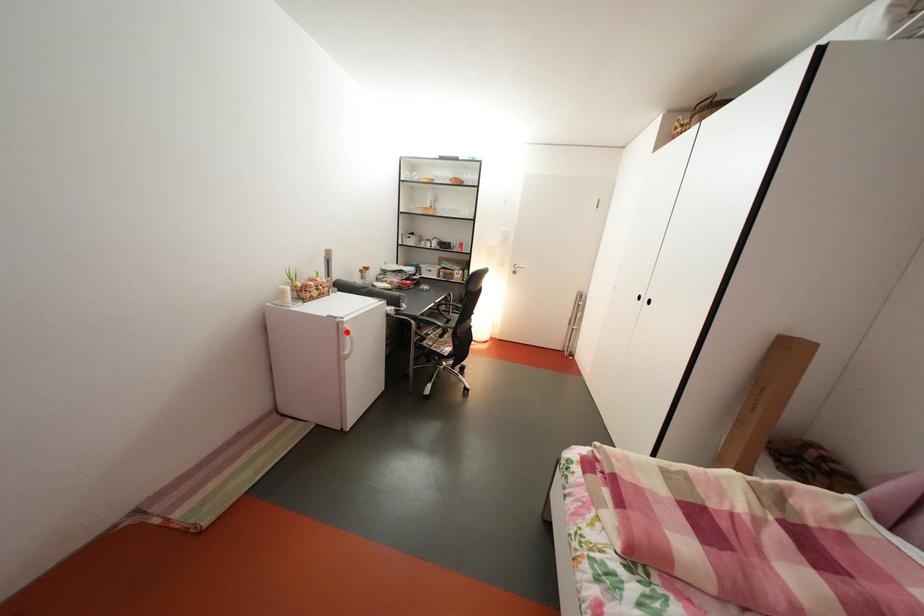
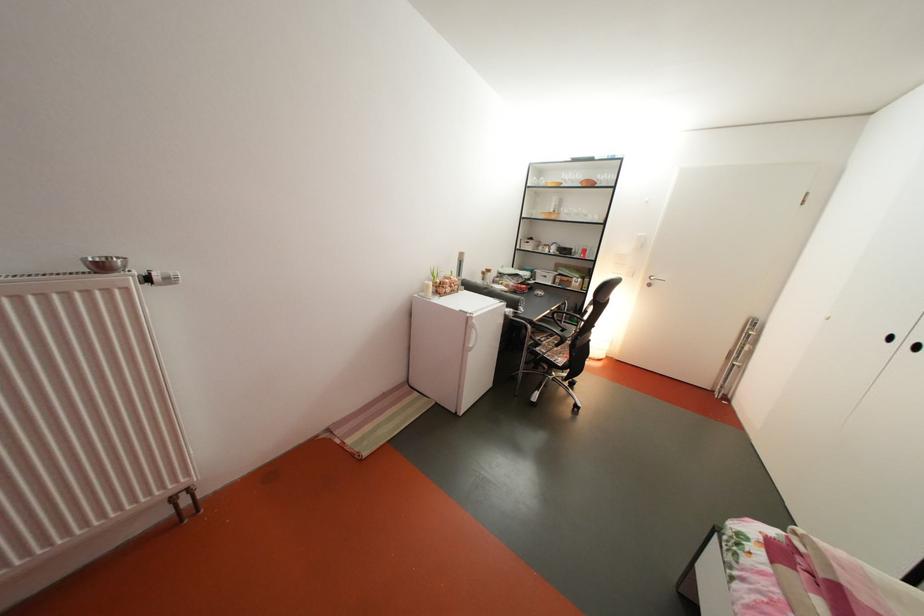
Where in the second image is the point corresponding to the highlighted location from the first image?

(477, 326)